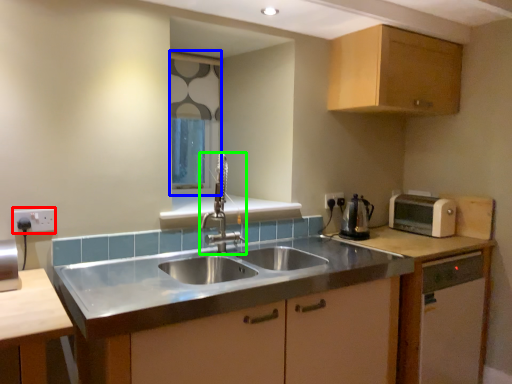
Question: Based on their relative distances, which object is farther from electric outlet (highlighted by a red box)? Choose from window screen (highlighted by a blue box) and tap (highlighted by a green box).

Choices:
 (A) window screen
 (B) tap

Answer: (A)